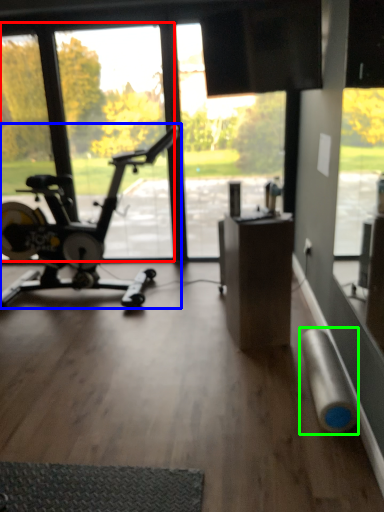
Question: Which object is the closest to the window screen (highlighted by a red box)? Choose among these: stationary bicycle (highlighted by a blue box) or duct tape (highlighted by a green box).

Choices:
 (A) stationary bicycle
 (B) duct tape

Answer: (A)